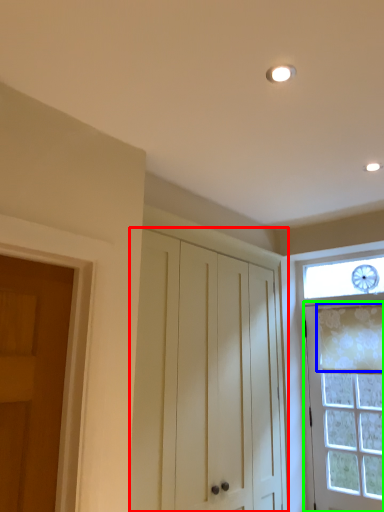
Question: Based on their relative distances, which object is farther from cabinetry (highlighted by a red box)? Choose from curtain (highlighted by a blue box) and door (highlighted by a green box).

Choices:
 (A) curtain
 (B) door

Answer: (A)